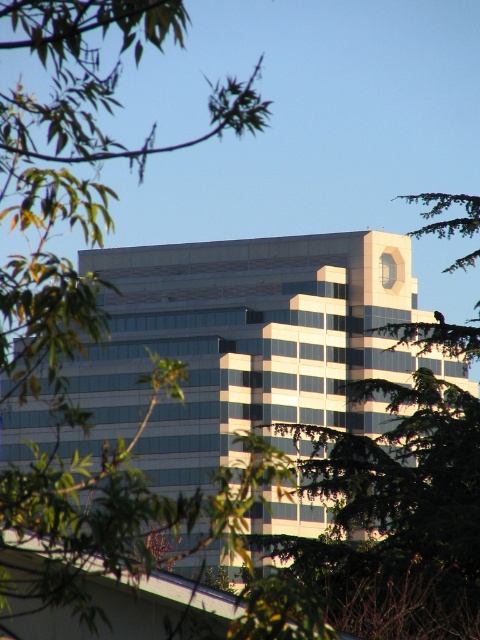
Which is above, white glass building at center or green leafy tree at upper left?

Positioned higher is green leafy tree at upper left.

Is the position of white glass building at center less distant than that of green leafy tree at upper left?

That is False.

Is point (255, 248) positioned in front of point (0, 182)?

No.

The image size is (480, 640). Find the location of `white glass building at center`. white glass building at center is located at coordinates (247, 344).